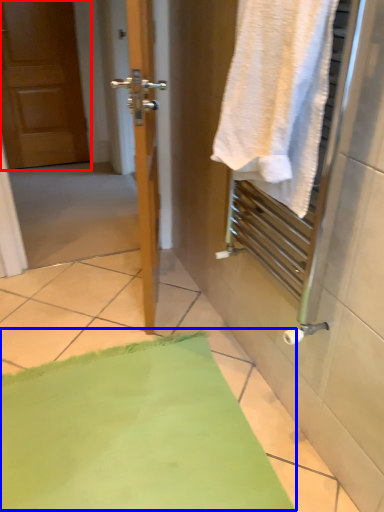
Question: Among these objects, which one is farthest to the camera, door (highlighted by a red box) or bath mat (highlighted by a blue box)?

Choices:
 (A) door
 (B) bath mat

Answer: (A)